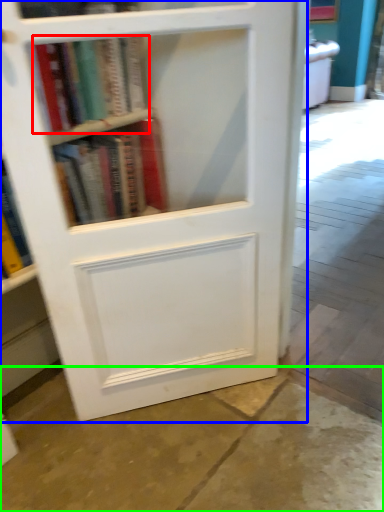
Question: Which object is the farthest from book (highlighted by a red box)? Choose among these: bookcase (highlighted by a blue box) or concrete (highlighted by a green box).

Choices:
 (A) bookcase
 (B) concrete

Answer: (B)